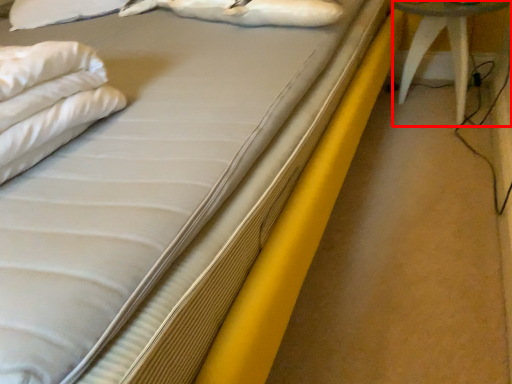
Question: Where is furniture (annotated by the red box) located in relation to animal in the image?

Choices:
 (A) left
 (B) right

Answer: (B)